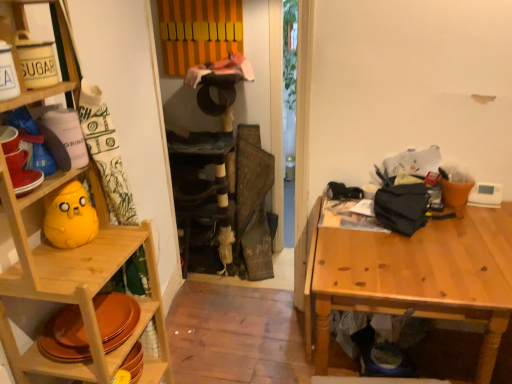
Question: From the image's perspective, relative to matte yellow plush at left, is wooden table at right above or below?

Choices:
 (A) above
 (B) below

Answer: (B)

Question: Is wooden table at right spatially inside matte yellow plush at left, or outside of it?

Choices:
 (A) inside
 (B) outside

Answer: (B)

Question: Estimate the real-world distances between objects in this image. Which object is farther from the matte yellow plush at left?

Choices:
 (A) wooden table at right
 (B) wooden shelf at left

Answer: (A)

Question: Which of these objects is positioned closest to the matte yellow plush at left?

Choices:
 (A) wooden table at right
 (B) wooden shelf at left

Answer: (B)